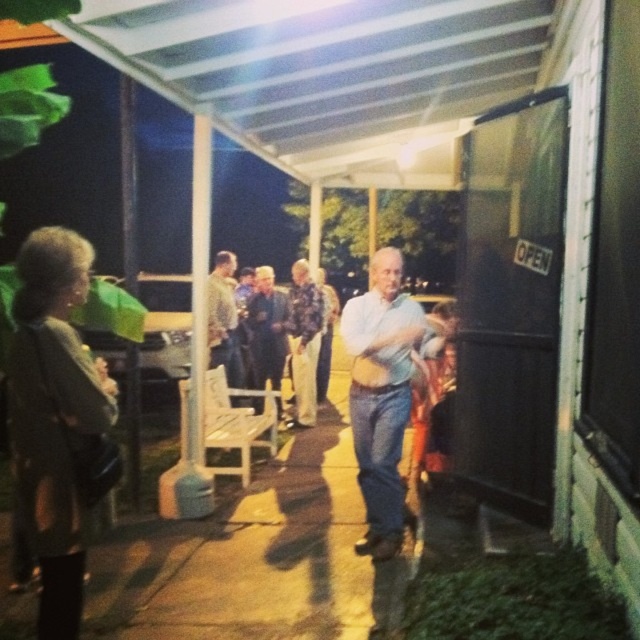
Can you confirm if light blue jeans at center is smaller than light brown leather jacket at center?

No, light blue jeans at center is not smaller than light brown leather jacket at center.

Who is more forward, [355,342] or [211,328]?

Positioned in front is point [355,342].

Is point (376, 496) farther from viewer compared to point (227, 276)?

No.

I want to click on light blue jeans at center, so click(x=381, y=392).

Who is positioned more to the left, floral-patterned shirt at center or light brown leather jacket at center?

Positioned to the left is light brown leather jacket at center.

Is floral-patterned shirt at center closer to camera compared to light brown leather jacket at center?

No, floral-patterned shirt at center is behind light brown leather jacket at center.

Is point (314, 424) positioned behind point (230, 256)?

Yes, it is behind point (230, 256).

Find the location of a particular element. Image resolution: width=640 pixels, height=640 pixels. floral-patterned shirt at center is located at coordinates (304, 340).

Who is positioned more to the right, light blue jeans at center or floral-patterned shirt at center?

light blue jeans at center is more to the right.

Which is behind, point (364, 449) or point (308, 422)?

The point (308, 422) is behind.

Who is more forward, (364, 371) or (314, 419)?

Point (364, 371) is more forward.

Identify the location of light blue jeans at center. The height and width of the screenshot is (640, 640). (381, 392).